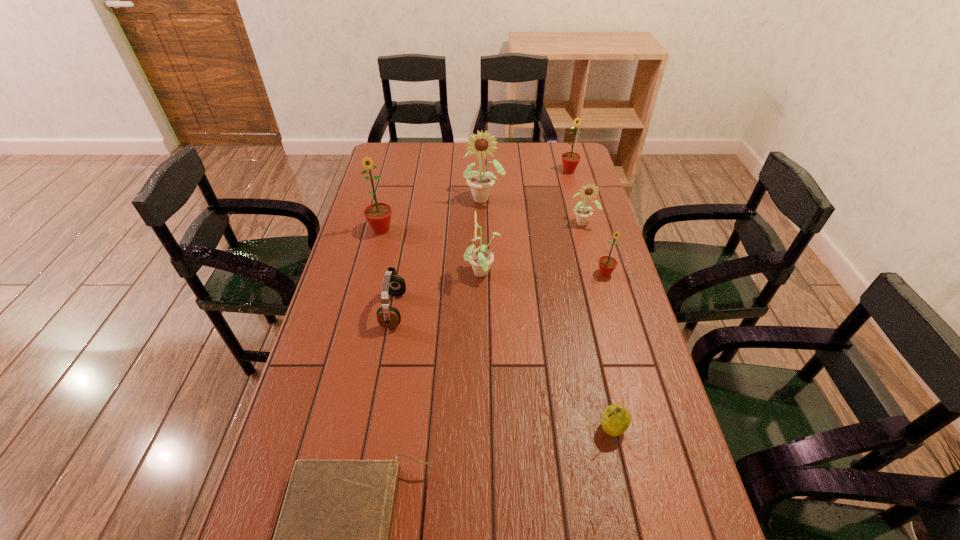
The height and width of the screenshot is (540, 960). I want to click on the farthest yellow sunflower, so click(x=480, y=183).

Where is `the biggest yellow sunflower`? the biggest yellow sunflower is located at coordinates (480, 183).

The height and width of the screenshot is (540, 960). What are the coordinates of `the second farthest green sunflower` in the screenshot? It's located at (378, 215).

You are a GUI agent. You are given a task and a screenshot of the screen. Output one action in this format:
    pyautogui.click(x=<x>, y=<y>)
    Task: Click on the biggest green sunflower
    The image size is (960, 540).
    Given the screenshot: What is the action you would take?
    pyautogui.click(x=378, y=215)

You are a GUI agent. You are given a task and a screenshot of the screen. Output one action in this format:
    pyautogui.click(x=<x>, y=<y>)
    Task: Click on the nearest yellow sunflower
    
    Given the screenshot: What is the action you would take?
    pyautogui.click(x=481, y=258)

Identify the location of the farthest sunflower. (570, 160).

Identify the location of the second biggest green sunflower. The image size is (960, 540). (570, 160).

You are a GUI agent. You are given a task and a screenshot of the screen. Output one action in this format:
    pyautogui.click(x=<x>, y=<y>)
    Task: Click on the second nearest yellow sunflower
    The image size is (960, 540).
    Given the screenshot: What is the action you would take?
    pyautogui.click(x=583, y=213)

What are the coordinates of `the rightmost yellow sunflower` in the screenshot? It's located at (583, 213).

This screenshot has width=960, height=540. I want to click on the smallest green sunflower, so click(x=607, y=264).